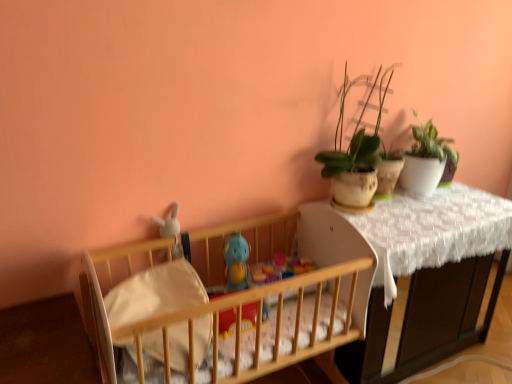
Describe the element at coordinates (234, 303) in the screenshot. This screenshot has width=512, height=384. I see `wooden crib at left` at that location.

What is the approximate width of blue rubber duck at center, positioned as the second toy in left-to-right order?

It is 10.34 centimeters.

Identify the location of white lace-covered table at upper right. This screenshot has height=384, width=512. (428, 275).

Measure the distance between point (338, 199) and camera.

Point (338, 199) and camera are 1.87 meters apart.

This screenshot has width=512, height=384. Describe the element at coordinates (154, 293) in the screenshot. I see `white soft crib sheet at center` at that location.

Where is `wooden crib at left`? wooden crib at left is located at coordinates (234, 303).

Would you say blue rubber duck at center, which ranks as the first toy in right-to-left order, is part of white lace-covered table at upper right's contents?

No, blue rubber duck at center, which ranks as the first toy in right-to-left order, is located outside of white lace-covered table at upper right.

Does white lace-covered table at upper right have a lesser width compared to blue rubber duck at center, positioned as the second toy in left-to-right order?

In fact, white lace-covered table at upper right might be wider than blue rubber duck at center, positioned as the second toy in left-to-right order.

Is white lace-covered table at upper right not near blue rubber duck at center, which ranks as the first toy in right-to-left order?

white lace-covered table at upper right is positioned a significant distance from blue rubber duck at center, which ranks as the first toy in right-to-left order.

Which object is further away from the camera, white lace-covered table at upper right or blue rubber duck at center, which ranks as the first toy in right-to-left order?

blue rubber duck at center, which ranks as the first toy in right-to-left order.

From a real-world perspective, is wooden crib at left physically located above or below white soft crib sheet at center?

Clearly, from a real-world perspective, wooden crib at left is below white soft crib sheet at center.

At what (x,y) coordinates should I click in order to perform the action: click on sheet located behind the wooden crib at left. Please return your answer as a coordinate pair (x, y). The width and height of the screenshot is (512, 384). Looking at the image, I should click on (154, 293).

Who is shorter, wooden crib at left or white soft crib sheet at center?

With less height is white soft crib sheet at center.

Based on the photo, is wooden crib at left to the left of white soft crib sheet at center from the viewer's perspective?

Incorrect, wooden crib at left is not on the left side of white soft crib sheet at center.

Does point (183, 252) come in front of point (414, 353)?

Yes, point (183, 252) is closer to viewer.

Which object is closer to the camera, white plush rabbit at left, the second toy positioned from the right, or white lace-covered table at upper right?

white lace-covered table at upper right is more forward.

Is white plush rabbit at left, the second toy positioned from the right, taller or shorter than white lace-covered table at upper right?

Clearly, white plush rabbit at left, the second toy positioned from the right, is shorter compared to white lace-covered table at upper right.

Based on the photo, considering the relative sizes of white fabric changing table at lower left and matte clay pot at upper right, the first houseplant positioned from the left, in the image provided, is white fabric changing table at lower left bigger than matte clay pot at upper right, the first houseplant positioned from the left,?

Yes, white fabric changing table at lower left is bigger than matte clay pot at upper right, the first houseplant positioned from the left.

Is white fabric changing table at lower left to the left or to the right of matte clay pot at upper right, placed as the second houseplant when sorted from right to left, in the image?

In the image, white fabric changing table at lower left appears on the left side of matte clay pot at upper right, placed as the second houseplant when sorted from right to left.

Is white fabric changing table at lower left positioned in front of matte clay pot at upper right, placed as the second houseplant when sorted from right to left?

Yes, white fabric changing table at lower left is closer to the camera.

Is white fabric changing table at lower left positioned beyond the bounds of matte clay pot at upper right, the first houseplant positioned from the left?

white fabric changing table at lower left is positioned outside matte clay pot at upper right, the first houseplant positioned from the left.

From the image's perspective, is green matte plant at upper right, placed as the 2th houseplant when sorted from left to right, positioned above or below white plush rabbit at left, the 1th toy viewed from the left?

Clearly, from the image's perspective, green matte plant at upper right, placed as the 2th houseplant when sorted from left to right, is above white plush rabbit at left, the 1th toy viewed from the left.

Considering the sizes of green matte plant at upper right, marked as the first houseplant in a right-to-left arrangement, and white plush rabbit at left, the 1th toy viewed from the left, in the image, is green matte plant at upper right, marked as the first houseplant in a right-to-left arrangement, wider or thinner than white plush rabbit at left, the 1th toy viewed from the left,?

In the image, green matte plant at upper right, marked as the first houseplant in a right-to-left arrangement, appears to be wider than white plush rabbit at left, the 1th toy viewed from the left.

Would you say green matte plant at upper right, marked as the first houseplant in a right-to-left arrangement, contains white plush rabbit at left, the second toy positioned from the right?

That's incorrect, white plush rabbit at left, the second toy positioned from the right, is not inside green matte plant at upper right, marked as the first houseplant in a right-to-left arrangement.

Who is smaller, green matte plant at upper right, marked as the first houseplant in a right-to-left arrangement, or white plush rabbit at left, the second toy positioned from the right?

Smaller between the two is white plush rabbit at left, the second toy positioned from the right.

Considering the positions of points (127, 339) and (420, 190), is point (127, 339) closer to camera compared to point (420, 190)?

Yes, it is in front of point (420, 190).

Between wooden crib at left and green matte plant at upper right, marked as the first houseplant in a right-to-left arrangement, which one is positioned behind?

green matte plant at upper right, marked as the first houseplant in a right-to-left arrangement, is further from the camera.

From the image's perspective, which is below, wooden crib at left or green matte plant at upper right, marked as the first houseplant in a right-to-left arrangement?

wooden crib at left appears lower in the image.

Considering the sizes of objects wooden crib at left and green matte plant at upper right, placed as the 2th houseplant when sorted from left to right, in the image provided, who is smaller, wooden crib at left or green matte plant at upper right, placed as the 2th houseplant when sorted from left to right,?

Smaller between the two is green matte plant at upper right, placed as the 2th houseplant when sorted from left to right.

Could white lace-covered table at upper right be considered to be inside wooden crib at left?

Definitely not — white lace-covered table at upper right is not inside wooden crib at left.

How distant is wooden crib at left from white lace-covered table at upper right?

30.36 inches.

Who is smaller, wooden crib at left or white lace-covered table at upper right?

white lace-covered table at upper right.

Is point (298, 325) closer or farther from the camera than point (369, 375)?

Point (298, 325) is positioned closer to the camera compared to point (369, 375).

Image resolution: width=512 pixels, height=384 pixels. What are the coordinates of `toy that is the 2nd object located behind the white lace-covered table at upper right` in the screenshot? It's located at (236, 261).

This screenshot has width=512, height=384. In the image, there is a white soft crib sheet at center. Find the location of `infant bed below it (from the image's perspective)`. infant bed below it (from the image's perspective) is located at coordinates (234, 303).

Estimate the real-world distances between objects in this image. Which object is further from matte clay pot at upper right, the first houseplant positioned from the left, white lace-covered table at upper right or white plush rabbit at left, the 1th toy viewed from the left?

white lace-covered table at upper right lies further to matte clay pot at upper right, the first houseplant positioned from the left, than the other object.

Which object lies nearer to the anchor point green matte plant at upper right, placed as the 2th houseplant when sorted from left to right, blue rubber duck at center, which ranks as the first toy in right-to-left order, or white fabric changing table at lower left?

blue rubber duck at center, which ranks as the first toy in right-to-left order.

Looking at the image, which one is located further to green matte plant at upper right, marked as the first houseplant in a right-to-left arrangement, white plush rabbit at left, the 1th toy viewed from the left, or wooden crib at left?

white plush rabbit at left, the 1th toy viewed from the left, is positioned further to the anchor green matte plant at upper right, marked as the first houseplant in a right-to-left arrangement.

From the picture: Considering their positions, is white fabric changing table at lower left positioned closer to green matte plant at upper right, placed as the 2th houseplant when sorted from left to right, than blue rubber duck at center, positioned as the second toy in left-to-right order?

Based on the image, blue rubber duck at center, positioned as the second toy in left-to-right order, appears to be nearer to green matte plant at upper right, placed as the 2th houseplant when sorted from left to right.

Based on their spatial positions, is white fabric changing table at lower left or green matte plant at upper right, marked as the first houseplant in a right-to-left arrangement, closer to white lace-covered table at upper right?

green matte plant at upper right, marked as the first houseplant in a right-to-left arrangement, is positioned closer to the anchor white lace-covered table at upper right.

Which object lies further to the anchor point white lace-covered table at upper right, green matte plant at upper right, marked as the first houseplant in a right-to-left arrangement, or white fabric changing table at lower left?

The object further to white lace-covered table at upper right is white fabric changing table at lower left.

Which object lies nearer to the anchor point white plush rabbit at left, the second toy positioned from the right, green matte plant at upper right, marked as the first houseplant in a right-to-left arrangement, or matte clay pot at upper right, the first houseplant positioned from the left?

matte clay pot at upper right, the first houseplant positioned from the left, is closer to white plush rabbit at left, the second toy positioned from the right.

Considering their positions, is wooden crib at left positioned further to white soft crib sheet at center than white lace-covered table at upper right?

white lace-covered table at upper right.

Find the location of `toy between white plush rabbit at left, the second toy positioned from the right, and white lace-covered table at upper right`. toy between white plush rabbit at left, the second toy positioned from the right, and white lace-covered table at upper right is located at coordinates (236, 261).

Where is `table between wooden crib at left and green matte plant at upper right, marked as the first houseplant in a right-to-left arrangement, from left to right`? The image size is (512, 384). table between wooden crib at left and green matte plant at upper right, marked as the first houseplant in a right-to-left arrangement, from left to right is located at coordinates (428, 275).

Where is `houseplant between matte clay pot at upper right, placed as the second houseplant when sorted from right to left, and white lace-covered table at upper right vertically`? This screenshot has width=512, height=384. houseplant between matte clay pot at upper right, placed as the second houseplant when sorted from right to left, and white lace-covered table at upper right vertically is located at coordinates (426, 159).

This screenshot has height=384, width=512. Find the location of `infant bed located between white fabric changing table at lower left and white lace-covered table at upper right in the left-right direction`. infant bed located between white fabric changing table at lower left and white lace-covered table at upper right in the left-right direction is located at coordinates (234, 303).